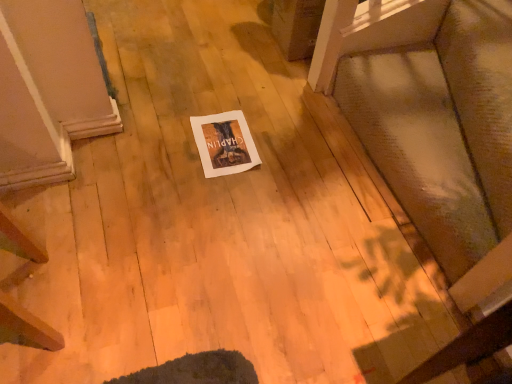
Question: In terms of size, does textured fabric cushion at lower right appear bigger or smaller than white paper at center?

Choices:
 (A) small
 (B) big

Answer: (B)

Question: From the image's perspective, is textured fabric cushion at lower right above or below white paper at center?

Choices:
 (A) below
 (B) above

Answer: (B)

Question: Considering the relative positions of textured fabric cushion at lower right and white paper at center in the image provided, is textured fabric cushion at lower right to the left or to the right of white paper at center?

Choices:
 (A) right
 (B) left

Answer: (A)

Question: Do you think white paper at center is within textured fabric cushion at lower right, or outside of it?

Choices:
 (A) outside
 (B) inside

Answer: (A)

Question: Is white paper at center wider or thinner than textured fabric cushion at lower right?

Choices:
 (A) wide
 (B) thin

Answer: (B)

Question: Does point (245, 167) appear closer or farther from the camera than point (477, 228)?

Choices:
 (A) farther
 (B) closer

Answer: (A)

Question: In the image, is white paper at center positioned in front of or behind textured fabric cushion at lower right?

Choices:
 (A) front
 (B) behind

Answer: (B)